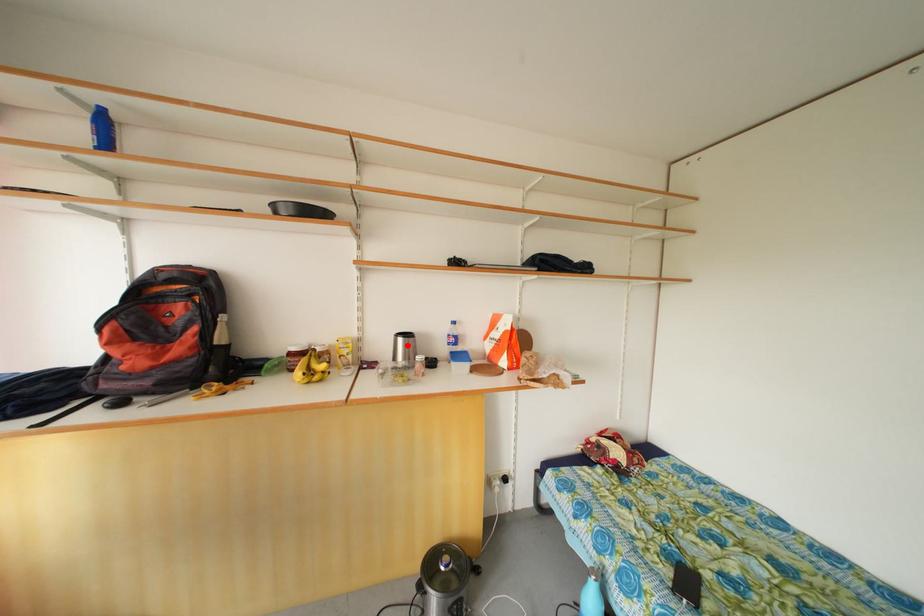
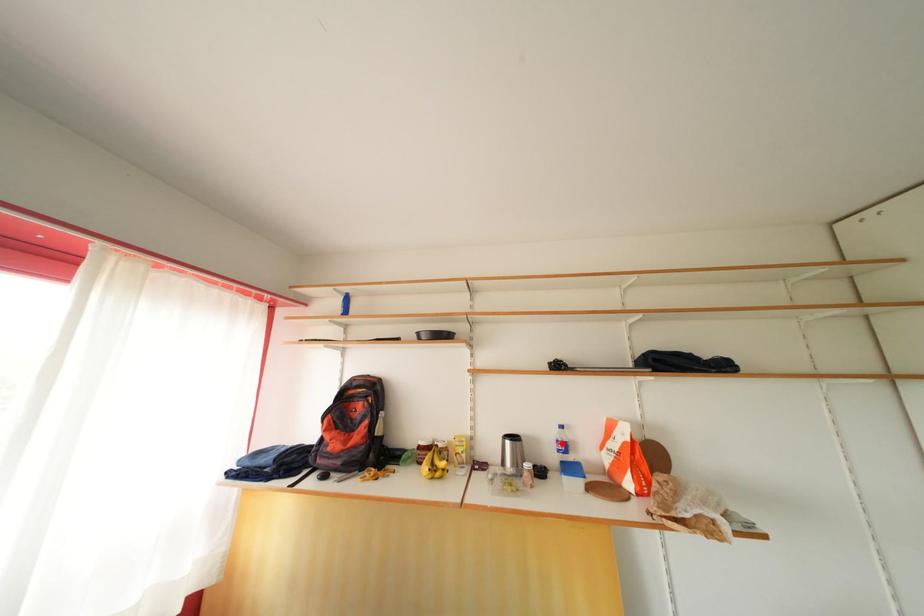
I am providing you with two images of the same scene from different viewpoints. A red point is marked on the first image and another point is marked on the second image. Do the highlighted points in image1 and image2 indicate the same real-world spot?

No